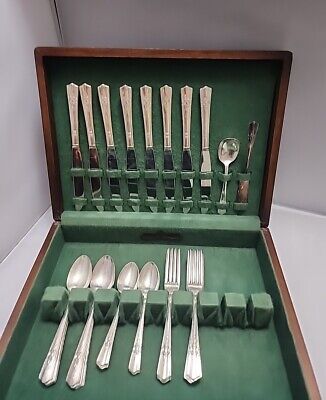
In order to click on spoons in this screenshot , I will do `click(75, 277)`, `click(103, 278)`, `click(126, 280)`, `click(147, 281)`, `click(223, 152)`.